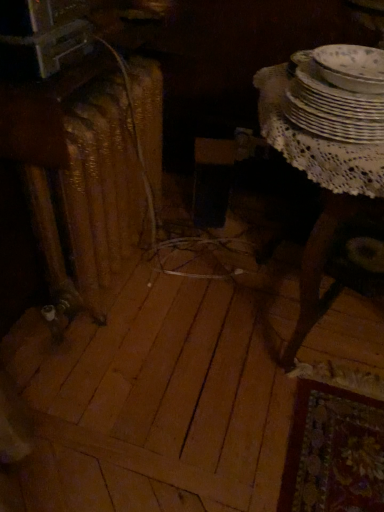
Question: Looking at their shapes, would you say white porcelain plates at upper right, acting as the 2th tableware starting from the bottom, is wider or thinner than white lace table at right?

Choices:
 (A) wide
 (B) thin

Answer: (B)

Question: From a real-world perspective, is white porcelain plates at upper right, the first tableware viewed from the top, above or below white lace table at right?

Choices:
 (A) above
 (B) below

Answer: (A)

Question: Considering the real-world distances, which object is farthest from the porcelain plates at upper right, which ranks as the 2th tableware in top-to-bottom order?

Choices:
 (A) rusty metal radiator at left
 (B) white lace table at right
 (C) white porcelain plates at upper right, acting as the 2th tableware starting from the bottom

Answer: (A)

Question: Which object is positioned closest to the rusty metal radiator at left?

Choices:
 (A) porcelain plates at upper right, which ranks as the 2th tableware in top-to-bottom order
 (B) white porcelain plates at upper right, acting as the 2th tableware starting from the bottom
 (C) white lace table at right

Answer: (C)